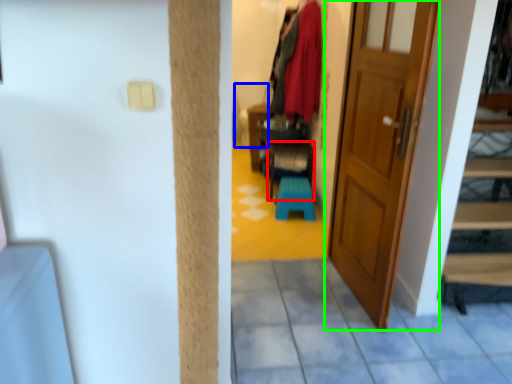
Question: Considering the real-world distances, which object is farthest from furniture (highlighted by a red box)? armchair (highlighted by a blue box) or door (highlighted by a green box)?

Choices:
 (A) armchair
 (B) door

Answer: (B)